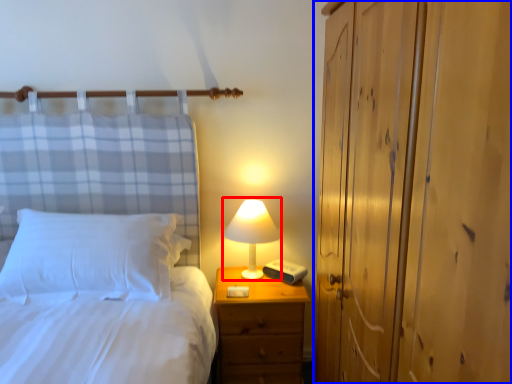
Question: Which of the following is the farthest to the observer, table lamp (highlighted by a red box) or dresser (highlighted by a blue box)?

Choices:
 (A) table lamp
 (B) dresser

Answer: (A)